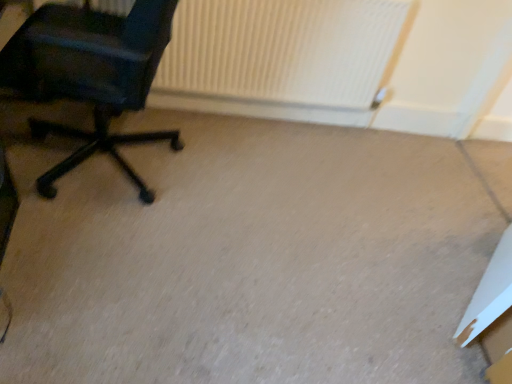
Question: Is white cardboard box at lower right far away from matte black office chair at left?

Choices:
 (A) yes
 (B) no

Answer: (A)

Question: Is white cardboard box at lower right to the left of matte black office chair at left from the viewer's perspective?

Choices:
 (A) yes
 (B) no

Answer: (B)

Question: Considering the relative positions of white cardboard box at lower right and matte black office chair at left in the image provided, is white cardboard box at lower right in front of matte black office chair at left?

Choices:
 (A) no
 (B) yes

Answer: (A)

Question: From a real-world perspective, is white cardboard box at lower right over matte black office chair at left?

Choices:
 (A) yes
 (B) no

Answer: (B)

Question: Is white cardboard box at lower right beside matte black office chair at left?

Choices:
 (A) no
 (B) yes

Answer: (A)

Question: Considering the relative sizes of white cardboard box at lower right and matte black office chair at left in the image provided, is white cardboard box at lower right wider than matte black office chair at left?

Choices:
 (A) no
 (B) yes

Answer: (A)

Question: Could you tell me if white ribbed radiator at upper center is facing matte black office chair at left?

Choices:
 (A) no
 (B) yes

Answer: (B)

Question: Can matte black office chair at left be found inside white ribbed radiator at upper center?

Choices:
 (A) no
 (B) yes

Answer: (A)

Question: Is white ribbed radiator at upper center at the left side of matte black office chair at left?

Choices:
 (A) yes
 (B) no

Answer: (B)

Question: Is white ribbed radiator at upper center outside of matte black office chair at left?

Choices:
 (A) yes
 (B) no

Answer: (A)

Question: Considering the relative sizes of white ribbed radiator at upper center and matte black office chair at left in the image provided, is white ribbed radiator at upper center smaller than matte black office chair at left?

Choices:
 (A) no
 (B) yes

Answer: (B)

Question: Would you consider white ribbed radiator at upper center to be distant from matte black office chair at left?

Choices:
 (A) yes
 (B) no

Answer: (B)

Question: Is white cardboard box at lower right thinner than white ribbed radiator at upper center?

Choices:
 (A) no
 (B) yes

Answer: (A)